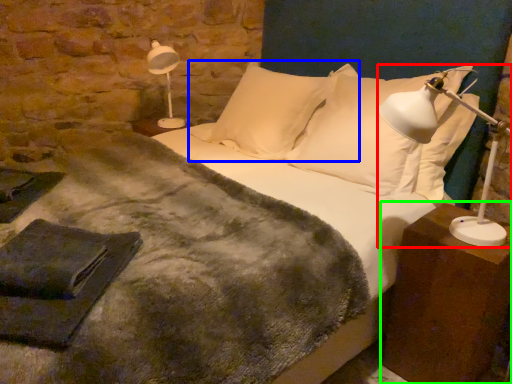
Question: Estimate the real-world distances between objects in this image. Which object is closer to table lamp (highlighted by a red box), pillow (highlighted by a blue box) or nightstand (highlighted by a green box)?

Choices:
 (A) pillow
 (B) nightstand

Answer: (B)